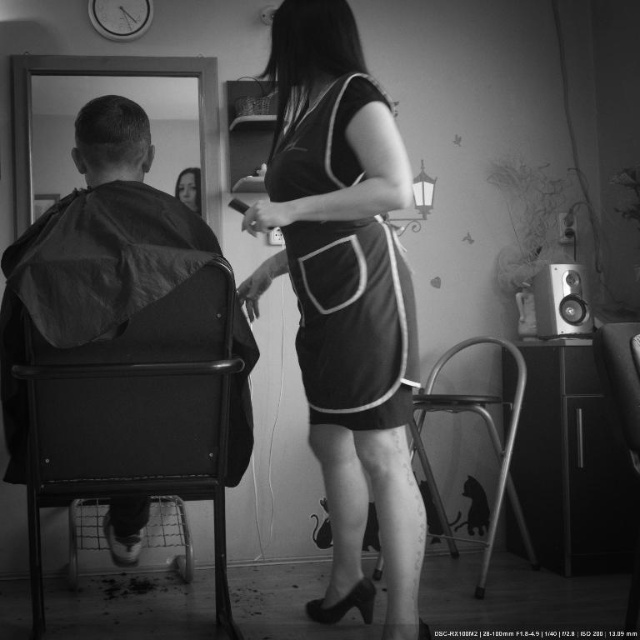
Question: Among these objects, which one is farthest from the camera?

Choices:
 (A) metallic black chair at left
 (B) metallic silver chair at right
 (C) smooth skin face at upper center
 (D) short hair at left

Answer: (C)

Question: Is velvet dress at center above metallic silver speaker at right?

Choices:
 (A) no
 (B) yes

Answer: (A)

Question: Which object appears farthest from the camera in this image?

Choices:
 (A) short hair at left
 (B) smooth skin face at upper center

Answer: (B)

Question: Can you confirm if black matte dress at center is positioned to the left of smooth skin face at upper center?

Choices:
 (A) no
 (B) yes

Answer: (A)

Question: Which object appears farthest from the camera in this image?

Choices:
 (A) metallic silver chair at lower center
 (B) velvet dress at center
 (C) short hair at left
 (D) metallic silver speaker at right

Answer: (D)

Question: From the image, what is the correct spatial relationship of velvet dress at center in relation to metallic silver chair at lower center?

Choices:
 (A) above
 (B) below

Answer: (A)